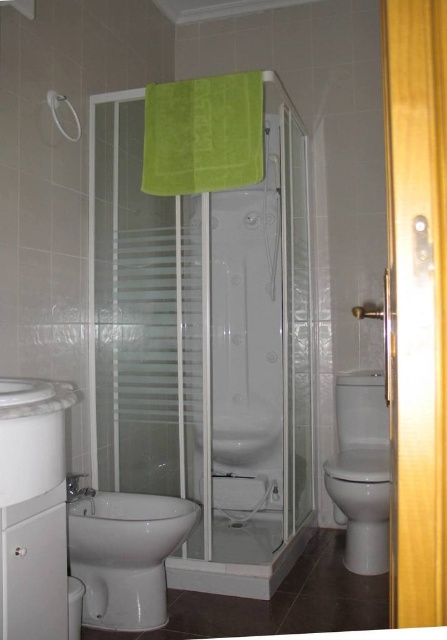
Question: Which of the following is the farthest from the observer?

Choices:
 (A) (148, 250)
 (B) (215, 156)

Answer: (A)

Question: Does wooden door at right appear on the left side of white glossy toilet at right?

Choices:
 (A) no
 (B) yes

Answer: (B)

Question: Which of these objects is positioned closest to the white glossy sink at lower left?

Choices:
 (A) transparent glass shower door at center
 (B) white glossy shower at upper left
 (C) wooden door at right
 (D) green fabric towel at upper center

Answer: (C)

Question: Which object is the closest to the transparent glass shower door at center?

Choices:
 (A) wooden door at right
 (B) green fabric towel at upper center
 (C) white glossy sink at lower left

Answer: (B)

Question: Is green fabric towel at upper center further to the viewer compared to white glossy sink at lower left?

Choices:
 (A) yes
 (B) no

Answer: (A)

Question: Is white glossy sink at lower left bigger than white glossy shower at upper left?

Choices:
 (A) yes
 (B) no

Answer: (A)